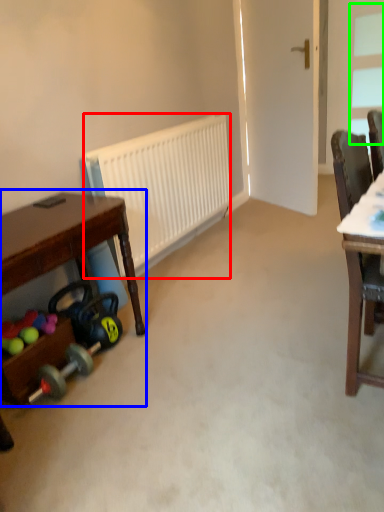
Question: Based on their relative distances, which object is nearer to radiator (highlighted by a red box)? Choose from desk (highlighted by a blue box) and window (highlighted by a green box).

Choices:
 (A) desk
 (B) window

Answer: (A)